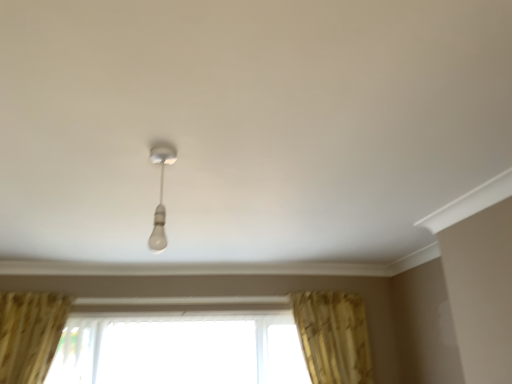
Identify the location of transparent glass window at center. This screenshot has width=512, height=384. (180, 349).

The height and width of the screenshot is (384, 512). I want to click on white glossy bulb at center, so click(160, 192).

In order to face white glossy bulb at center, should I rotate leftwards or rightwards?

Turn left by 12.875 degrees to look at white glossy bulb at center.

This screenshot has width=512, height=384. What are the coordinates of `transparent glass window at center` in the screenshot? It's located at (180, 349).

In the image, is transparent glass window at center on the left side or the right side of white glossy bulb at center?

From the image, it's evident that transparent glass window at center is to the left of white glossy bulb at center.

Is transparent glass window at center in front of white glossy bulb at center?

No, it is not.

How far apart are transparent glass window at center and white glossy bulb at center?

A distance of 5.71 feet exists between transparent glass window at center and white glossy bulb at center.

Is gold textured curtain at lower right closer to camera compared to transparent glass window at center?

No, gold textured curtain at lower right is behind transparent glass window at center.

Is gold textured curtain at lower right not near transparent glass window at center?

No, gold textured curtain at lower right is not far away from transparent glass window at center.

Does gold textured curtain at lower right have a smaller size compared to transparent glass window at center?

Yes, gold textured curtain at lower right is smaller than transparent glass window at center.

Between transparent glass window at center and gold textured curtain at lower right, which one is positioned in front?

transparent glass window at center is closer to the camera.

Is transparent glass window at center facing away from gold textured curtain at lower right?

That's not correct — transparent glass window at center is not looking away from gold textured curtain at lower right.

Can you confirm if transparent glass window at center is shorter than gold textured curtain at lower right?

Yes.

From a real-world perspective, does transparent glass window at center sit lower than gold textured curtain at lower right?

Correct, in the physical world, transparent glass window at center is lower than gold textured curtain at lower right.

From the picture: Is the position of white glossy bulb at center more distant than that of gold textured curtain at lower right?

No, white glossy bulb at center is closer to the viewer.

Looking at this image, from the image's perspective, between white glossy bulb at center and gold textured curtain at lower right, which one is located above?

From the image's view, white glossy bulb at center is above.

Considering the positions of objects white glossy bulb at center and gold textured curtain at lower right in the image provided, who is more to the left, white glossy bulb at center or gold textured curtain at lower right?

Positioned to the left is white glossy bulb at center.

Can you tell me how much gold textured curtain at lower right and white glossy bulb at center differ in facing direction?

There is a 1.43-degree angle between the facing directions of gold textured curtain at lower right and white glossy bulb at center.

From a real-world perspective, which is physically below, gold textured curtain at lower right or white glossy bulb at center?

From a 3D spatial view, gold textured curtain at lower right is below.

Does gold textured curtain at lower right have a smaller size compared to white glossy bulb at center?

No.

Is gold textured curtain at lower right aimed at white glossy bulb at center?

No, gold textured curtain at lower right is not aimed at white glossy bulb at center.

Which is more to the left, white glossy bulb at center or transparent glass window at center?

Positioned to the left is transparent glass window at center.

Is white glossy bulb at center outside of transparent glass window at center?

white glossy bulb at center is positioned outside transparent glass window at center.

You are a GUI agent. You are given a task and a screenshot of the screen. Output one action in this format:
    pyautogui.click(x=<x>, y=<y>)
    Task: Click on the lamp in front of the transparent glass window at center
    Image resolution: width=512 pixels, height=384 pixels.
    Given the screenshot: What is the action you would take?
    coord(160,192)

This screenshot has height=384, width=512. In order to click on curtain on the right of transparent glass window at center in this screenshot , I will do `click(333, 336)`.

When comparing their distances from gold textured curtain at lower right, does transparent glass window at center or white glossy bulb at center seem closer?

transparent glass window at center is positioned closer to the anchor gold textured curtain at lower right.

Considering their positions, is gold textured curtain at lower right positioned further to transparent glass window at center than white glossy bulb at center?

Among the two, white glossy bulb at center is located further to transparent glass window at center.

Estimate the real-world distances between objects in this image. Which object is further from gold textured curtain at lower right, white glossy bulb at center or transparent glass window at center?

Based on the image, white glossy bulb at center appears to be further to gold textured curtain at lower right.

From the image, which object appears to be nearer to white glossy bulb at center, transparent glass window at center or gold textured curtain at lower right?

The object closer to white glossy bulb at center is transparent glass window at center.

Based on their spatial positions, is gold textured curtain at lower right or transparent glass window at center closer to white glossy bulb at center?

The object closer to white glossy bulb at center is transparent glass window at center.

Estimate the real-world distances between objects in this image. Which object is closer to transparent glass window at center, white glossy bulb at center or gold textured curtain at lower right?

Among the two, gold textured curtain at lower right is located nearer to transparent glass window at center.

The image size is (512, 384). Find the location of `window between white glossy bulb at center and gold textured curtain at lower right in the front-back direction`. window between white glossy bulb at center and gold textured curtain at lower right in the front-back direction is located at coordinates (180, 349).